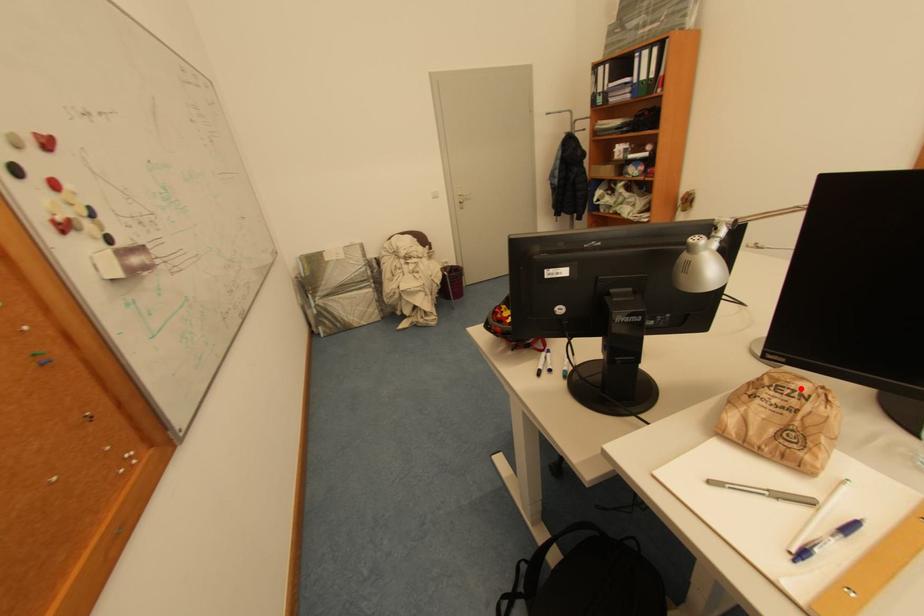
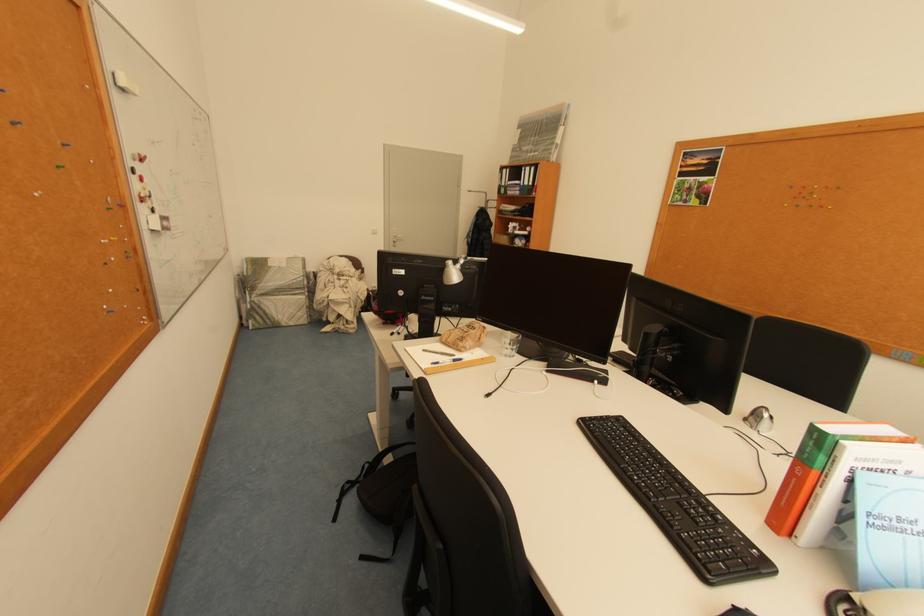
Locate, in the second image, the point that corresponds to the highlighted location in the first image.

(481, 328)